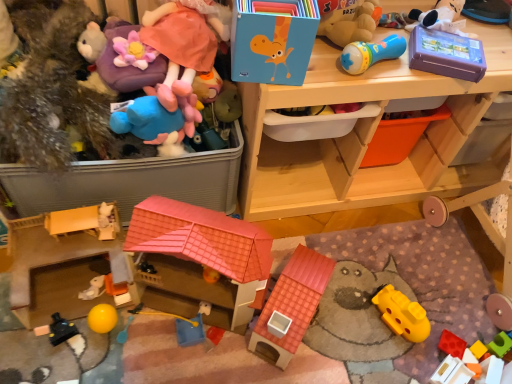
Identify the location of vacant space that is in between rubberized red block at lower right, the thirteenth toy viewed from the left, and yellow rubber ball at lower left, the fourth toy from the left. This screenshot has width=512, height=384. (301, 344).